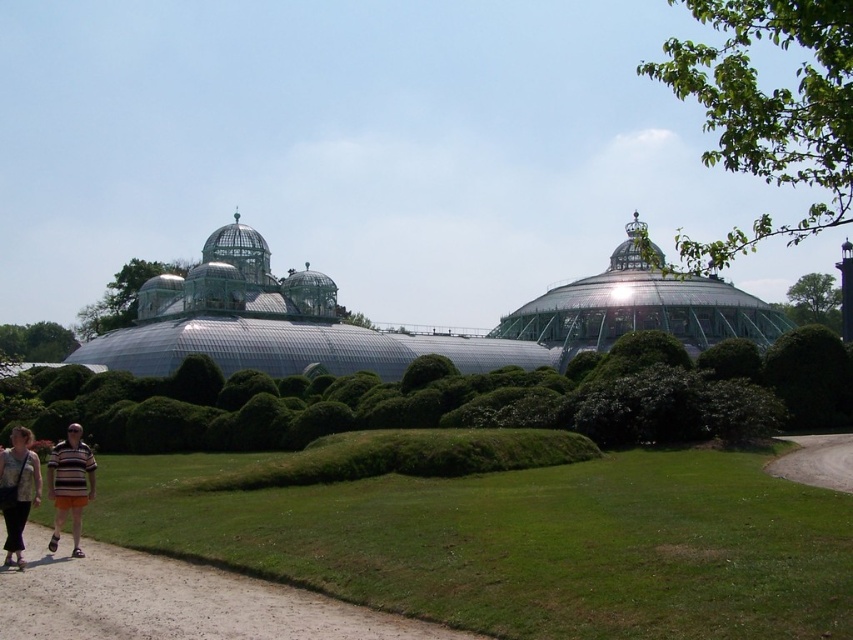
Question: Which point is closer to the camera taking this photo?

Choices:
 (A) click(288, 422)
 (B) click(235, 246)
 (C) click(86, 477)
 (D) click(289, 636)

Answer: (D)

Question: Which object appears closest to the camera in this image?

Choices:
 (A) dirt/gravel path at lower right
 (B) denim pants at lower left
 (C) brown dirt path at lower left

Answer: (C)

Question: Is brown dirt path at lower left thinner than striped shirt at lower left?

Choices:
 (A) yes
 (B) no

Answer: (B)

Question: Based on their relative distances, which object is farther from the green leafy bush at center?

Choices:
 (A) denim pants at lower left
 (B) dirt/gravel path at lower right

Answer: (A)

Question: Is transparent glass conservatory at center closer to camera compared to dirt/gravel path at lower right?

Choices:
 (A) no
 (B) yes

Answer: (A)

Question: Does green leafy bush at center have a larger size compared to striped cotton shirt at lower left?

Choices:
 (A) yes
 (B) no

Answer: (A)